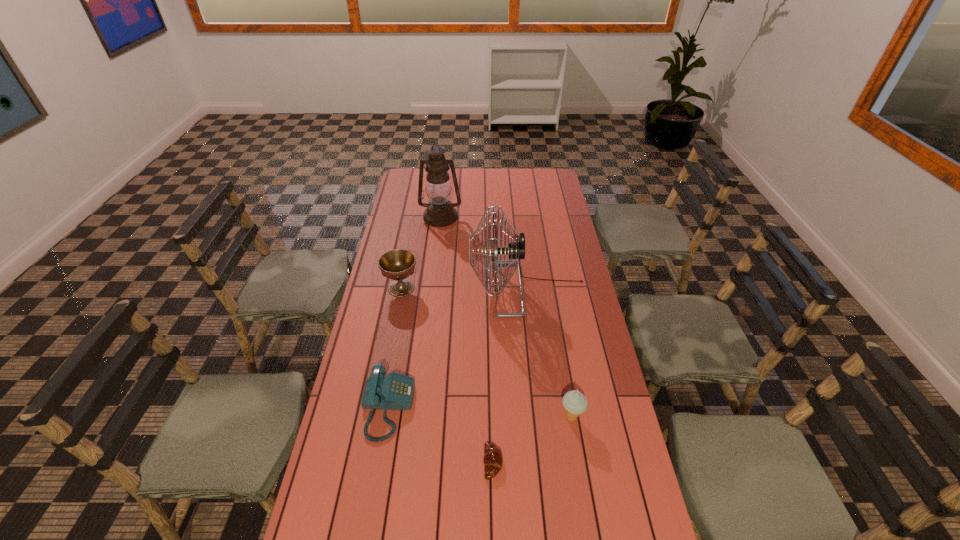
Where is `vacant space located on the front-facing side of the fan`? The height and width of the screenshot is (540, 960). vacant space located on the front-facing side of the fan is located at coordinates (388, 289).

Where is `vacant space situated on the right of the chalice`? vacant space situated on the right of the chalice is located at coordinates click(x=516, y=288).

Where is `free region located on the front of the icecream`? The height and width of the screenshot is (540, 960). free region located on the front of the icecream is located at coordinates (578, 458).

I want to click on vacant space situated 0.220m on the dial of the second shortest object, so click(484, 408).

The width and height of the screenshot is (960, 540). I want to click on vacant point located on the left of the crescent roll, so click(x=366, y=463).

The width and height of the screenshot is (960, 540). I want to click on oil lamp positioned at the left edge, so click(440, 212).

This screenshot has height=540, width=960. In order to click on chalice present at the left edge in this screenshot , I will do `click(398, 264)`.

The width and height of the screenshot is (960, 540). Find the location of `telephone that is at the left edge`. telephone that is at the left edge is located at coordinates (395, 391).

Where is `fan that is positioned at the right edge`? This screenshot has height=540, width=960. fan that is positioned at the right edge is located at coordinates (516, 250).

You are a GUI agent. You are given a task and a screenshot of the screen. Output one action in this format:
    pyautogui.click(x=<x>, y=<y>)
    Task: Click on the icecream at the right edge
    Image resolution: width=960 pixels, height=540 pixels.
    Given the screenshot: What is the action you would take?
    pyautogui.click(x=574, y=402)